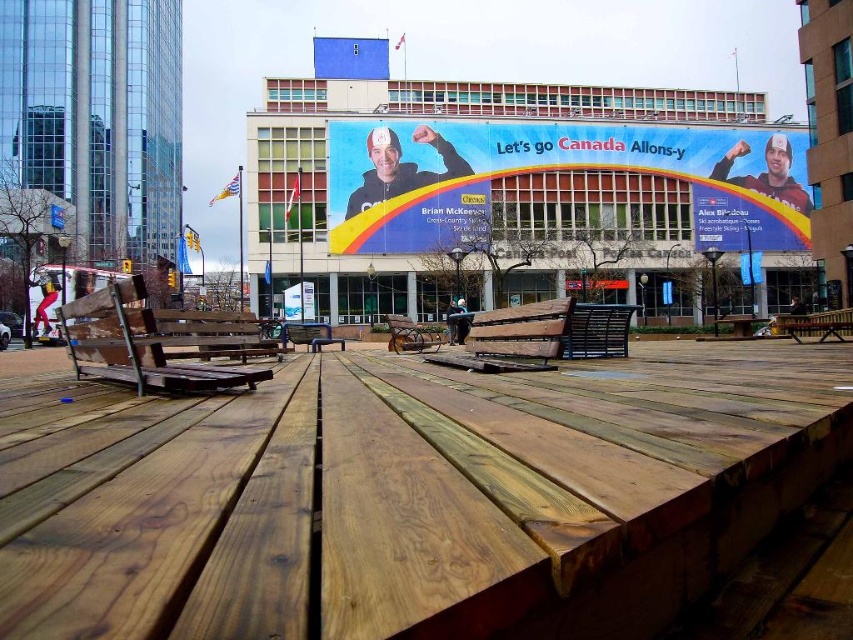
You are planning to host a small gathering in the plaza. You need to choose between the wooden park bench at center and the brown wooden picnic table at center for seating. Which one can accommodate more people?

The brown wooden picnic table at center is larger in size compared to the wooden park bench at center, so it can accommodate more people.

You are standing at the entrance of the plaza and want to find the natural wood park bench at center. According to the coordinates provided, where should you look to find it?

The natural wood park bench at center is located at coordinates point (512, 339), so you should look towards the center of the image where those coordinates point to find it.

You are standing at the edge of the plaza and want to sit on the natural wood park bench at center. There is a wooden park bench at center blocking your path. Can you walk around it to reach your desired bench?

The natural wood park bench at center is 5.34 meters away from the wooden park bench at center. Since the distance between them is significant, you can easily walk around the wooden park bench at center to reach the natural wood park bench at center.